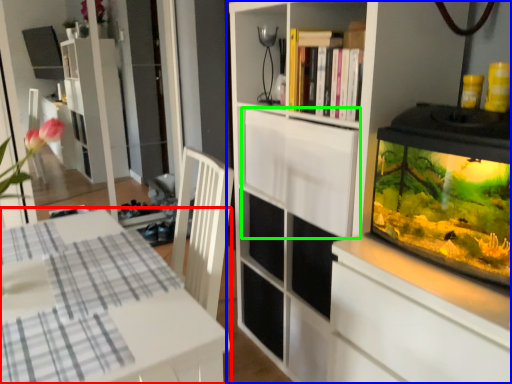
Question: Considering the real-world distances, which object is closest to table (highlighted by a red box)? cupboard (highlighted by a blue box) or cabinetry (highlighted by a green box).

Choices:
 (A) cupboard
 (B) cabinetry

Answer: (B)